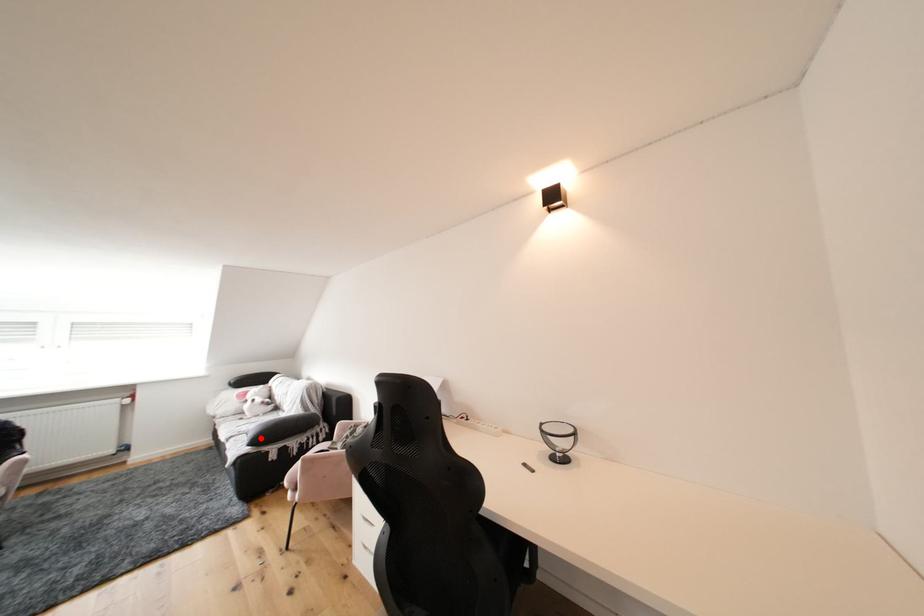
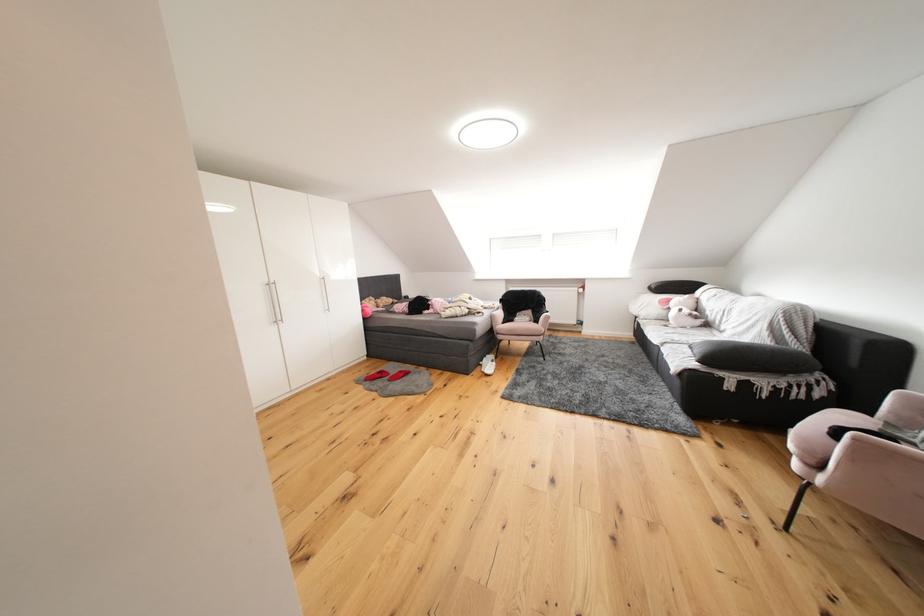
Find the pixel in the second image that matches the highlighted location in the first image.

(709, 354)